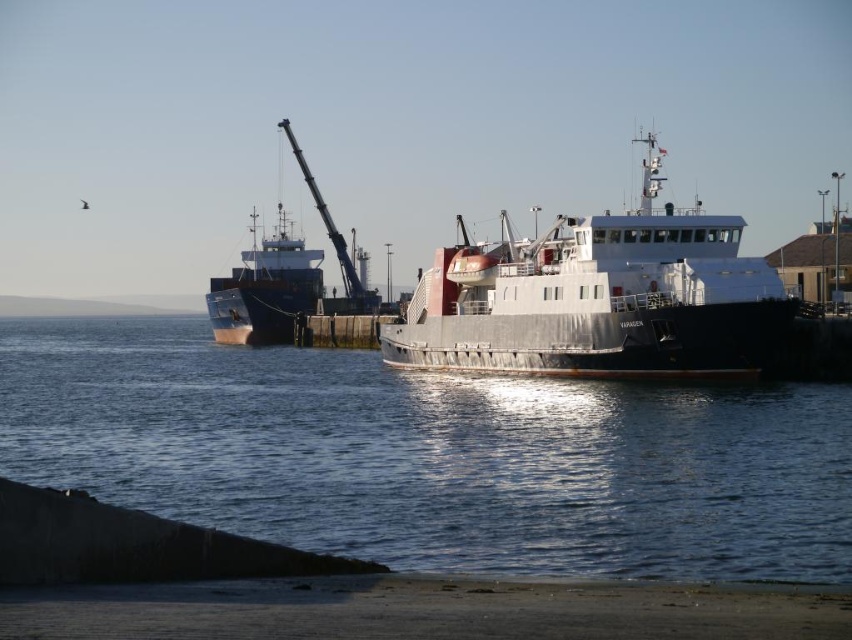
You are a photographer planning to capture the harbor scene. You want to ensure that the clear water at center and the metallic gray ferry at center are both visible in your shot. Based on their sizes in the image, which object should you focus on to include both in the frame?

The metallic gray ferry at center occupies more space than the clear water at center, so focusing on the ferry while framing the shot would naturally include the smaller clear water at center within the composition.

You are a dock worker who needs to load cargo onto both the metallic gray ferry at center and the blue matte cargo ship at center. Given their sizes, which vessel can accommodate more cargo?

The metallic gray ferry at center is larger in size than the blue matte cargo ship at center, so it can accommodate more cargo.

You are standing at the pier looking at the ferry VARADEN. There are two points marked on the ship, one at coordinate point (757, 472) and another at point (634, 289). Which point is closer to you?

Point (757, 472) is closer to the camera than point (634, 289).